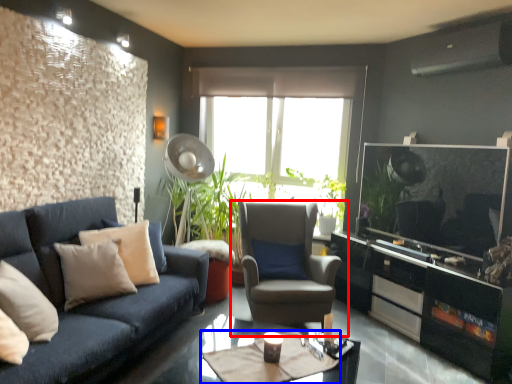
Question: Which object appears closest to the camera in this image, chair (highlighted by a red box) or cocktail table (highlighted by a blue box)?

Choices:
 (A) chair
 (B) cocktail table

Answer: (B)